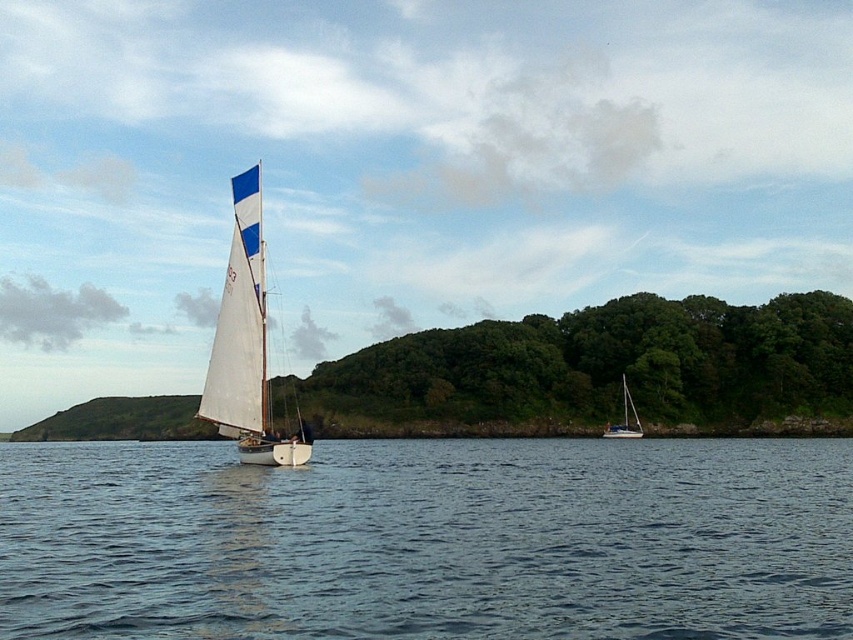
You are standing on the deck of the sailboat in the foreground and want to determine which of the two points, point (15, 598) or point (225, 360), is nearer to you. Based on the scene description, which point is closer?

Point (15, 598) is closer to the viewer than point (225, 360), so it is the nearer point.

In the scene shown: You are a photographer trying to capture the white glossy sailboat at center and the blue water at center in a single shot. Based on their positions, which object should you frame first to ensure both are in the shot?

The blue water at center is to the left of the white glossy sailboat at center, so you should frame the white glossy sailboat at center first since it is positioned to the right, allowing the blue water at center to naturally fall into the frame from the left side.

You are a photographer planning to capture the white sail at left and the white glossy sailboat at center in a single frame. Based on their sizes in the image, which object would appear wider in the photo?

The white sail at left appears wider in the photo since its width surpasses that of the white glossy sailboat at center.